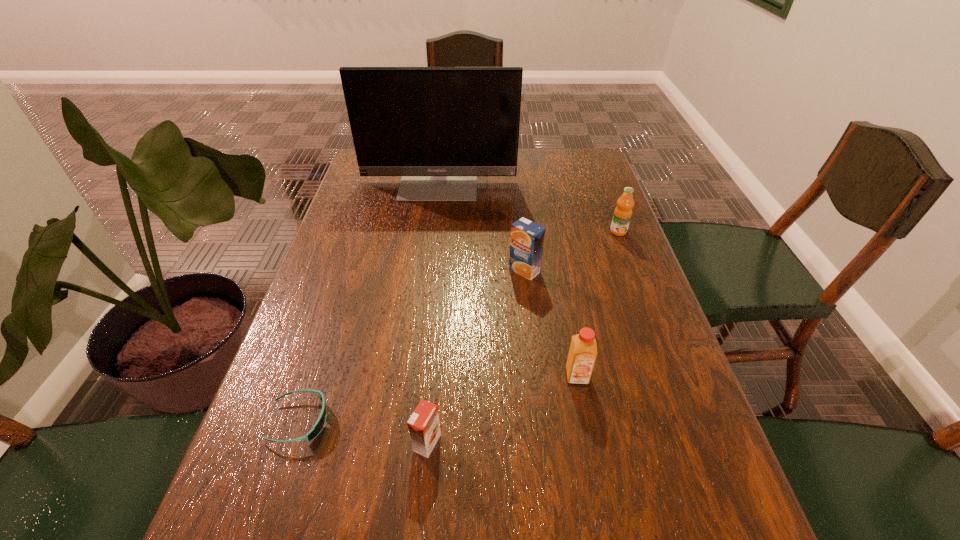
The image size is (960, 540). I want to click on object situated at the right edge, so click(x=623, y=211).

The height and width of the screenshot is (540, 960). What are the coordinates of `object that is at the far left corner` in the screenshot? It's located at (439, 128).

The width and height of the screenshot is (960, 540). In the image, there is a desktop. Identify the location of vacant space at the left edge. (379, 193).

At what (x,y) coordinates should I click in order to perform the action: click on vacant region at the right edge. Please return your answer as a coordinate pair (x, y). This screenshot has height=540, width=960. Looking at the image, I should click on (619, 389).

You are a GUI agent. You are given a task and a screenshot of the screen. Output one action in this format:
    pyautogui.click(x=<x>, y=<y>)
    Task: Click on the vacant space at the far right corner of the desktop
    This screenshot has height=540, width=960.
    Given the screenshot: What is the action you would take?
    pyautogui.click(x=573, y=172)

Where is `vacant space in between the third farthest object and the tallest object`? The image size is (960, 540). vacant space in between the third farthest object and the tallest object is located at coordinates (482, 226).

Where is `empty space that is in between the second object from right to left and the fifth nearest object`? empty space that is in between the second object from right to left and the fifth nearest object is located at coordinates (598, 303).

This screenshot has height=540, width=960. What are the coordinates of `vacant point located between the fifth nearest object and the third nearest object` in the screenshot? It's located at (598, 303).

This screenshot has height=540, width=960. Identify the location of vacant point located between the rightmost object and the farthest object. (529, 206).

Identify the location of free space between the computer monitor and the fourth nearest object. Image resolution: width=960 pixels, height=540 pixels. (482, 226).